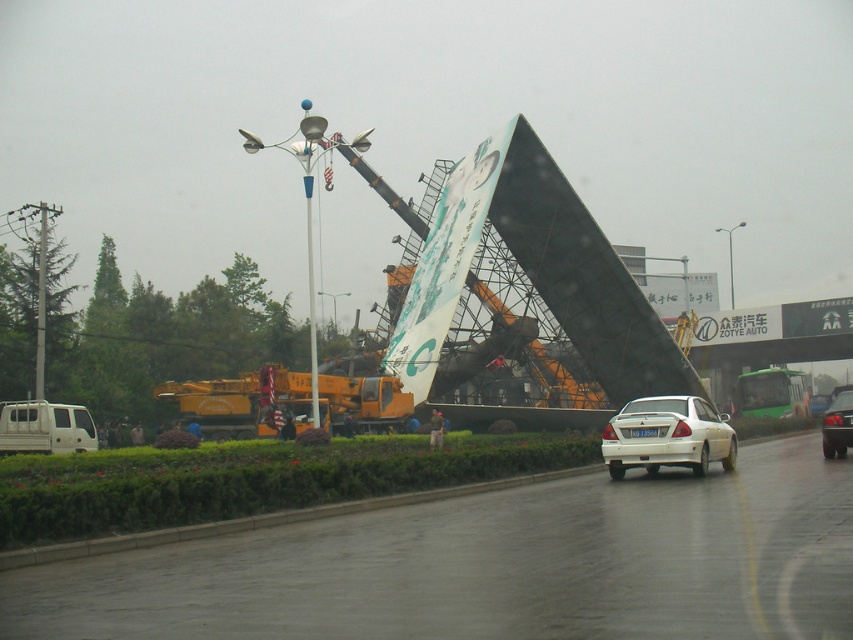
You are a pedestrian waiting at the crosswalk near the road. You see the white matte van at lower left and the shiny silver sedan at center. Which vehicle is closer to you?

The white matte van at lower left is closer to you because the shiny silver sedan at center is behind it.

You are a pedestrian standing at the origin point of the image coordinate system. You want to cross the road to reach the grassy area where people are gathered. The white matte sedan at center is blocking your path. Can you safely walk around the sedan to reach the grassy area without crossing the road? Please explain your reasoning based on the sedan position.

The white matte sedan at center is located at coordinate point (666,435). Since the sedan is in the center of the road, walking around it would require crossing the road, which is unsafe. Therefore, it is not safe to walk around the sedan to reach the grassy area without crossing the road.